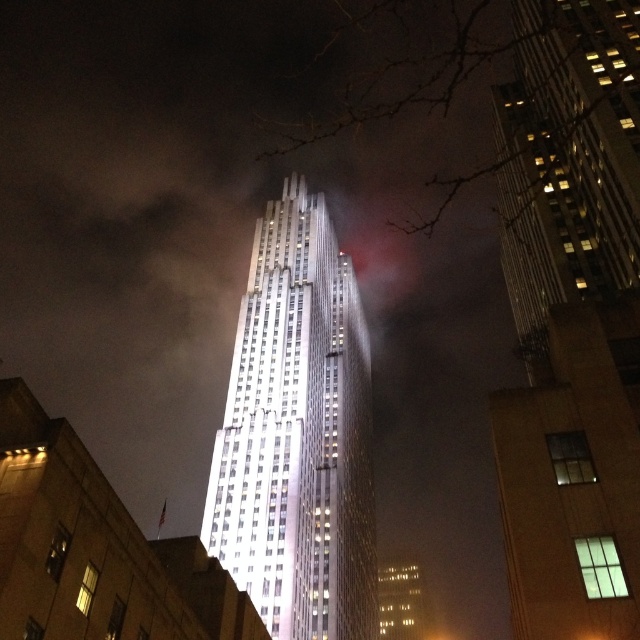
Which is in front, point (573, 1) or point (358, 509)?

Point (573, 1) is more forward.

Is reflective glass skyscraper at center closer to the viewer compared to shiny glass tower at center?

Yes, reflective glass skyscraper at center is closer to the viewer.

Locate an element on the screen. The image size is (640, 640). reflective glass skyscraper at center is located at coordinates (572, 317).

Where is `reflective glass skyscraper at center`? The height and width of the screenshot is (640, 640). reflective glass skyscraper at center is located at coordinates (572, 317).